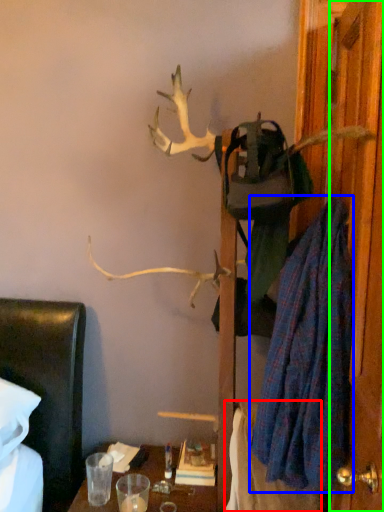
Question: Based on their relative distances, which object is nearer to blanket (highlighted by a red box)? Choose from robe (highlighted by a blue box) and door (highlighted by a green box).

Choices:
 (A) robe
 (B) door

Answer: (A)